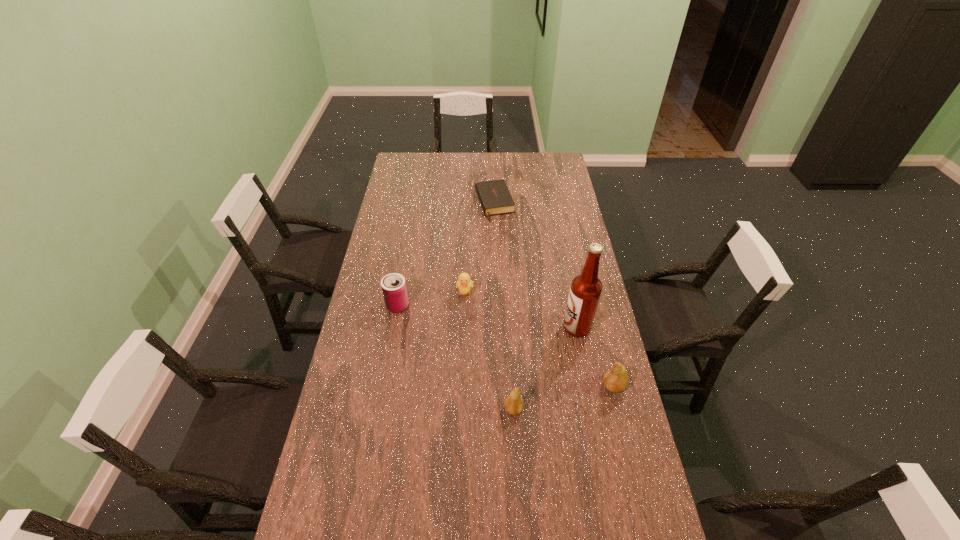
Where is `free spot located 0.230m on the left of the shorter pear`? The width and height of the screenshot is (960, 540). free spot located 0.230m on the left of the shorter pear is located at coordinates (431, 409).

Where is `vacant region located 0.120m on the front of the fifth farthest object`? The height and width of the screenshot is (540, 960). vacant region located 0.120m on the front of the fifth farthest object is located at coordinates (624, 432).

You are a GUI agent. You are given a task and a screenshot of the screen. Output one action in this format:
    pyautogui.click(x=<x>, y=<y>)
    Task: Click on the free spot located on the front-facing side of the second object from left to right
    
    Given the screenshot: What is the action you would take?
    pyautogui.click(x=462, y=395)

The image size is (960, 540). Identify the location of free space located 0.190m on the right of the Bible. (553, 204).

Identify the location of vacant space located 0.380m on the label side of the tallest object. (460, 327).

Find the location of `vacant area situated on the label side of the tallest object`. vacant area situated on the label side of the tallest object is located at coordinates (546, 327).

I want to click on free space located 0.380m on the label side of the tallest object, so click(460, 327).

The height and width of the screenshot is (540, 960). In order to click on vacant area situated on the front of the leftmost object in this screenshot , I will do (x=382, y=393).

Locate an element on the screen. The image size is (960, 540). object positioned at the left edge is located at coordinates (394, 289).

You are a GUI agent. You are given a task and a screenshot of the screen. Output one action in this format:
    pyautogui.click(x=<x>, y=<y>)
    Task: Click on the pear at the right edge
    
    Given the screenshot: What is the action you would take?
    pyautogui.click(x=615, y=379)